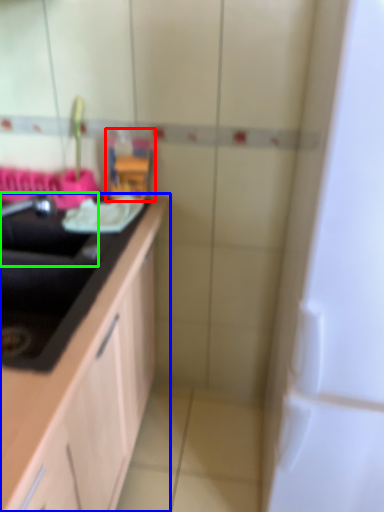
Question: Considering the real-world distances, which object is farthest from toy (highlighted by a red box)? countertop (highlighted by a blue box) or sink (highlighted by a green box)?

Choices:
 (A) countertop
 (B) sink

Answer: (A)